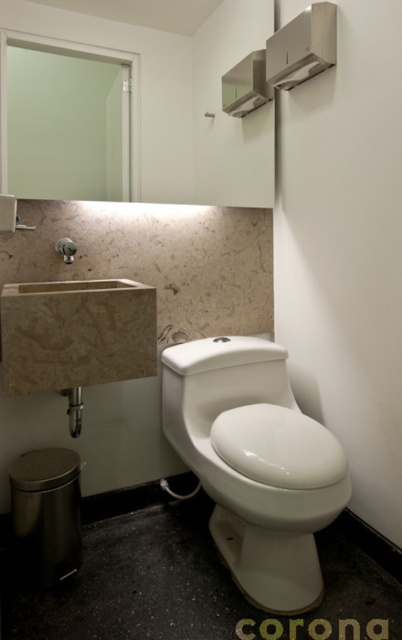
Question: Which is nearer to the white glossy toilet at center?

Choices:
 (A) brushed metal faucet at left
 (B) green matte mirror at upper left
 (C) white glossy mirror at upper center

Answer: (A)

Question: Estimate the real-world distances between objects in this image. Which object is closer to the green matte mirror at upper left?

Choices:
 (A) white glossy mirror at upper center
 (B) white glossy toilet at center

Answer: (A)

Question: Is white glossy toilet at center thinner than brushed metal faucet at left?

Choices:
 (A) no
 (B) yes

Answer: (A)

Question: Is white glossy toilet at center smaller than brushed metal faucet at left?

Choices:
 (A) yes
 (B) no

Answer: (B)

Question: Is white glossy toilet at center to the left of white glossy mirror at upper center from the viewer's perspective?

Choices:
 (A) yes
 (B) no

Answer: (B)

Question: Which object appears closest to the camera in this image?

Choices:
 (A) brushed metal faucet at left
 (B) green matte mirror at upper left

Answer: (A)